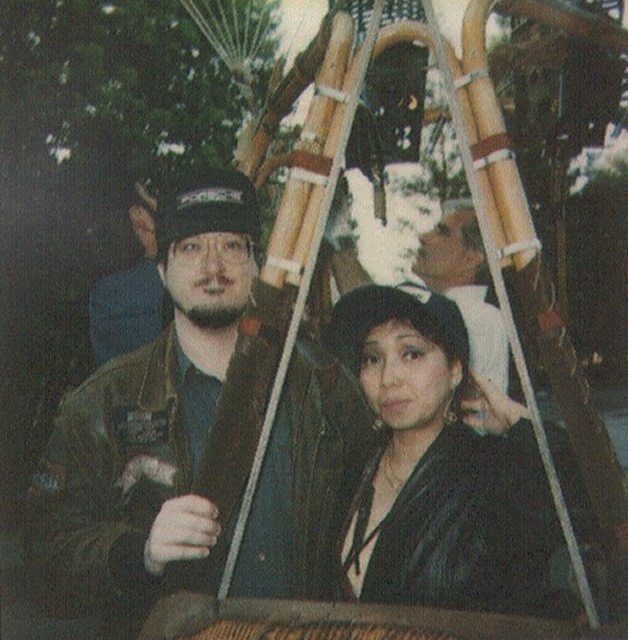
Question: Considering the real-world distances, which object is closest to the black leather jacket at center?

Choices:
 (A) matte black cap at upper center
 (B) matte black jacket at left

Answer: (A)

Question: Is the position of matte black cap at upper center less distant than that of matte black jacket at left?

Choices:
 (A) yes
 (B) no

Answer: (B)

Question: Is black leather jacket at center in front of matte black jacket at left?

Choices:
 (A) yes
 (B) no

Answer: (A)

Question: Does black leather jacket at center have a lesser width compared to matte black jacket at left?

Choices:
 (A) yes
 (B) no

Answer: (A)

Question: Estimate the real-world distances between objects in this image. Which object is farther from the black leather jacket at center?

Choices:
 (A) green matte jacket at center
 (B) matte black cap at upper center

Answer: (B)

Question: Which point appears farthest from the camera in this image?

Choices:
 (A) (121, 333)
 (B) (441, 342)

Answer: (A)